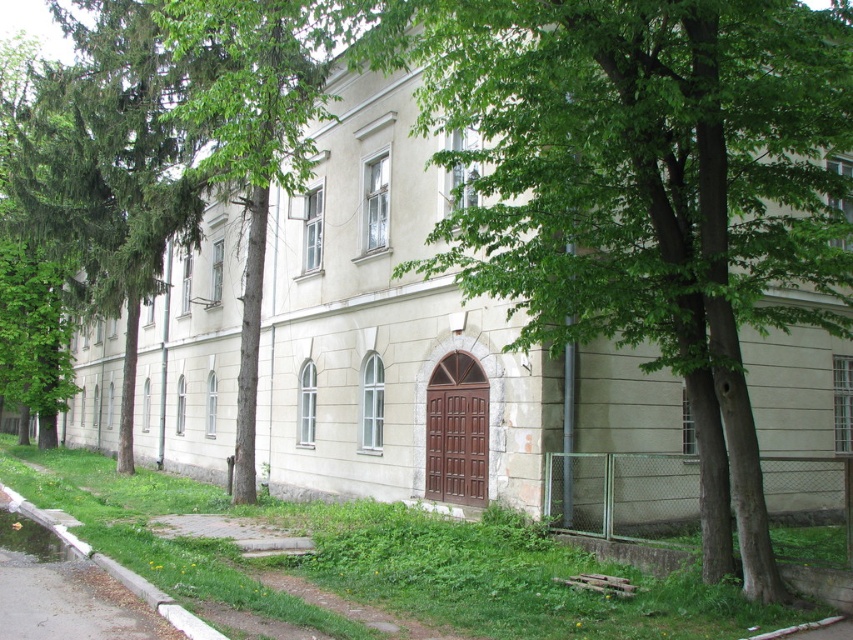
Who is shorter, green leafy tree at center or white concrete curb at lower left?

green leafy tree at center is shorter.

Is green leafy tree at center further to camera compared to white concrete curb at lower left?

Yes.

The height and width of the screenshot is (640, 853). What do you see at coordinates (643, 189) in the screenshot?
I see `green leafy tree at center` at bounding box center [643, 189].

I want to click on green leafy tree at center, so click(643, 189).

Between gray concrete sidewalk at lower left and white concrete curb at lower left, which one appears on the right side from the viewer's perspective?

From the viewer's perspective, gray concrete sidewalk at lower left appears more on the right side.

Does gray concrete sidewalk at lower left have a larger size compared to white concrete curb at lower left?

Incorrect, gray concrete sidewalk at lower left is not larger than white concrete curb at lower left.

Locate an element on the screen. gray concrete sidewalk at lower left is located at coordinates (70, 602).

What do you see at coordinates (643, 189) in the screenshot? I see `green leafy tree at center` at bounding box center [643, 189].

Who is more distant from viewer, (782, 252) or (33, 611)?

The point (782, 252) is more distant.

This screenshot has width=853, height=640. In order to click on green leafy tree at center in this screenshot , I will do 643,189.